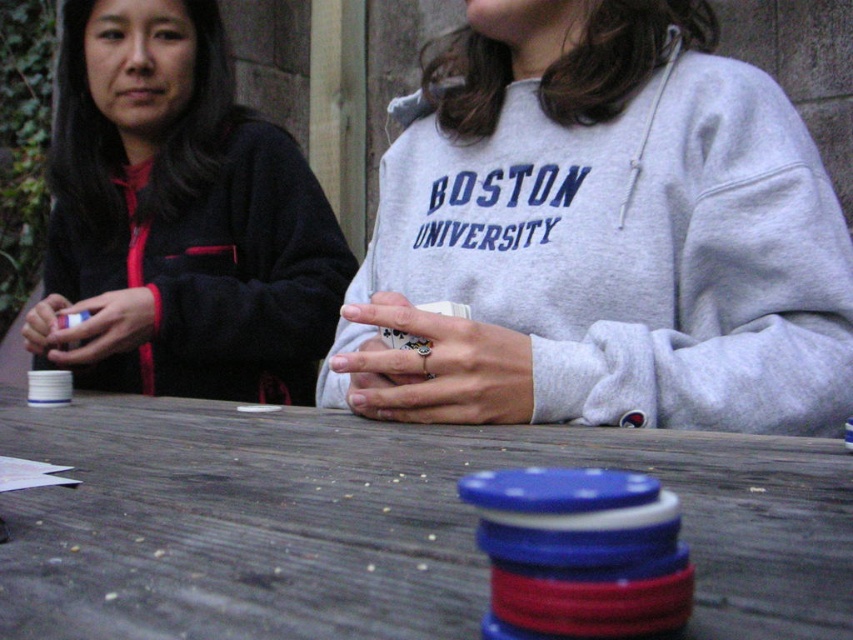
You are standing at the point with coordinates point (86,561) and want to walk to the point with coordinates point (811,374). Is the point you want to reach in front of or behind you?

The point (811,374) is behind point (86,561), so the point you want to reach is behind you.

You are a delivery robot that needs to place a small package between the wooden table at center and the dark blue fleece jacket at left. The package is 24 inches long. Can you fit it in the space between them?

The distance between the wooden table at center and the dark blue fleece jacket at left is 24.12 inches. Since the package is 24 inches long, it can fit in the space between them with a small amount of clearance.